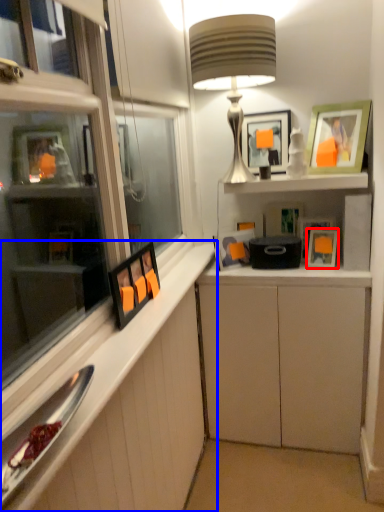
Question: Which object is closer to the camera taking this photo, picture frame (highlighted by a red box) or cabinetry (highlighted by a blue box)?

Choices:
 (A) picture frame
 (B) cabinetry

Answer: (B)